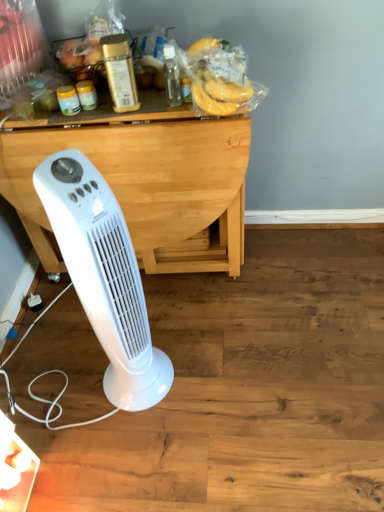
I want to click on vacant space behind white plastic tower fan at lower left, so click(x=160, y=324).